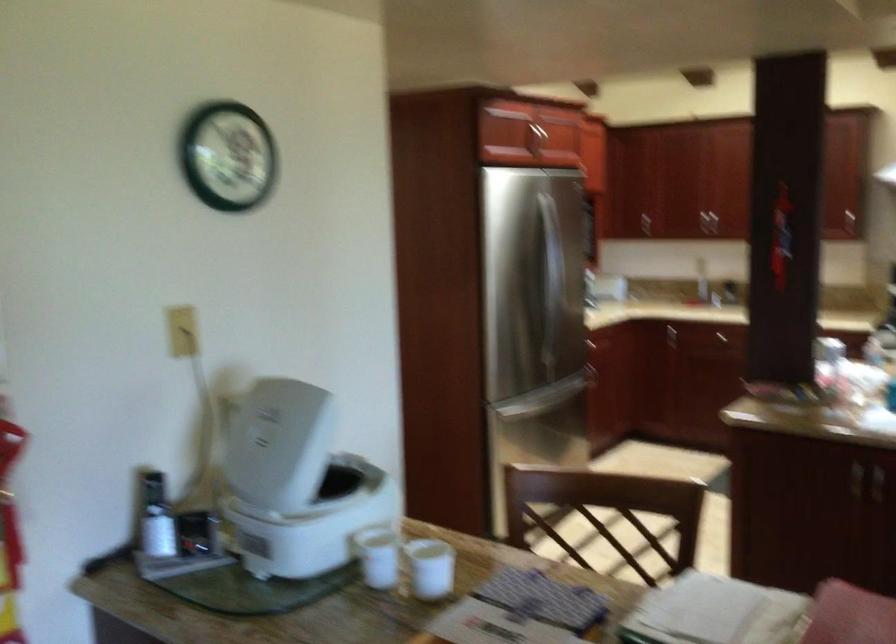
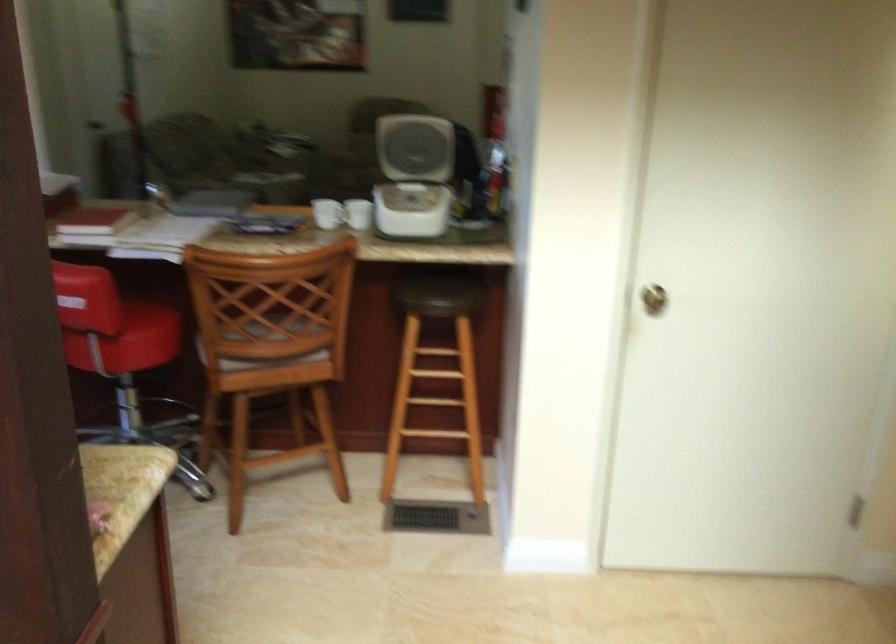
Locate, in the second image, the point that corresponds to (371,573) in the first image.

(358, 214)